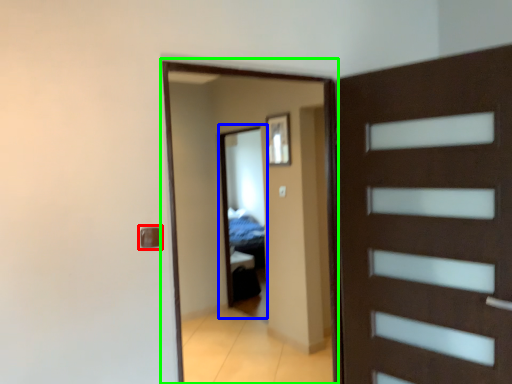
Question: Considering the real-world distances, which object is farthest from door handle (highlighted by a red box)? mirror (highlighted by a blue box) or screen door (highlighted by a green box)?

Choices:
 (A) mirror
 (B) screen door

Answer: (A)